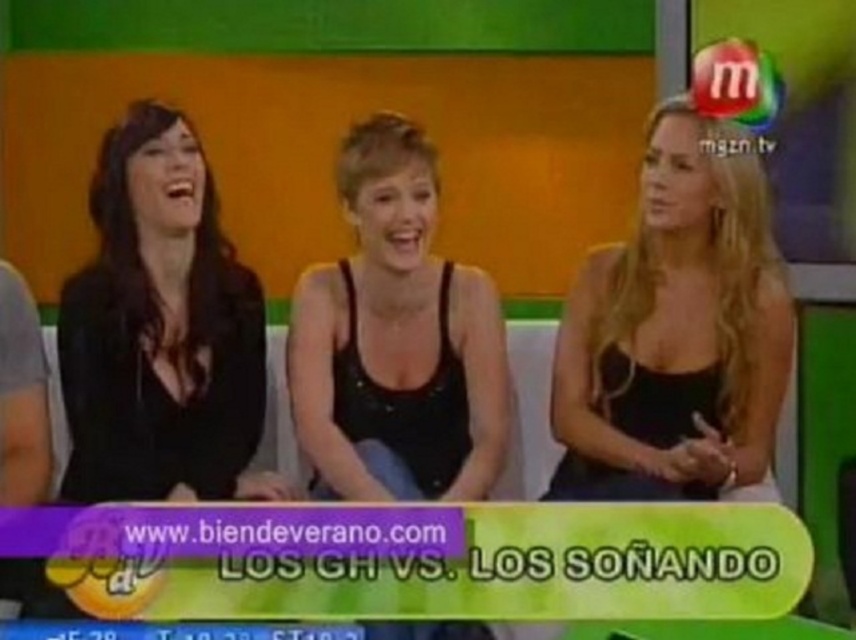
Question: Which object is farther from the camera taking this photo?

Choices:
 (A) black matte dress at left
 (B) black matte tank top at center

Answer: (A)

Question: Is black matte dress at center wider than black matte tank top at center?

Choices:
 (A) no
 (B) yes

Answer: (B)

Question: Does black matte dress at left appear on the left side of black matte tank top at center?

Choices:
 (A) yes
 (B) no

Answer: (A)

Question: Does black matte dress at left have a greater width compared to black matte tank top at center?

Choices:
 (A) yes
 (B) no

Answer: (B)

Question: Which point appears farthest from the camera in this image?

Choices:
 (A) (143, 294)
 (B) (711, 433)
 (C) (376, 310)

Answer: (C)

Question: Based on their relative distances, which object is nearer to the black matte dress at center?

Choices:
 (A) black matte dress at left
 (B) black matte tank top at center

Answer: (B)